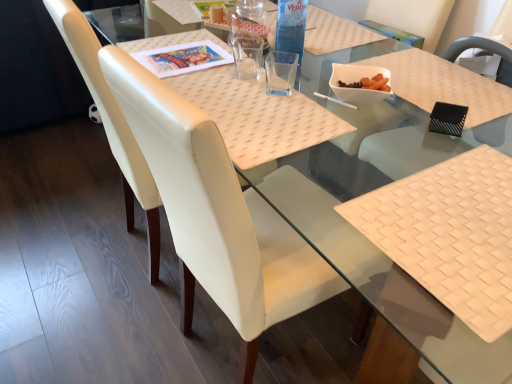
Question: Is point (450, 183) positioned closer to the camera than point (494, 84)?

Choices:
 (A) farther
 (B) closer

Answer: (B)

Question: From their relative heights in the image, would you say white woven placemat at lower right is taller or shorter than black mesh chair at upper right, marked as the first chair in a right-to-left arrangement?

Choices:
 (A) tall
 (B) short

Answer: (B)

Question: Which of these objects is positioned farthest from the transparent plastic bottle at upper center?

Choices:
 (A) woven beige placemat at center
 (B) white woven placemat at lower right
 (C) white leather chair at center, which ranks as the second chair in left-to-right order
 (D) black mesh chair at upper right, marked as the first chair in a right-to-left arrangement
 (E) white glossy bowl at center

Answer: (B)

Question: Estimate the real-world distances between objects in this image. Which object is closer to the white leather chair at center, acting as the 2th chair starting from the right?

Choices:
 (A) white woven placemat at lower right
 (B) black mesh chair at upper right, marked as the first chair in a right-to-left arrangement
 (C) transparent plastic bottle at upper center
 (D) white leather chair at left, positioned as the 1th chair in left-to-right order
 (E) woven beige placemat at center

Answer: (E)